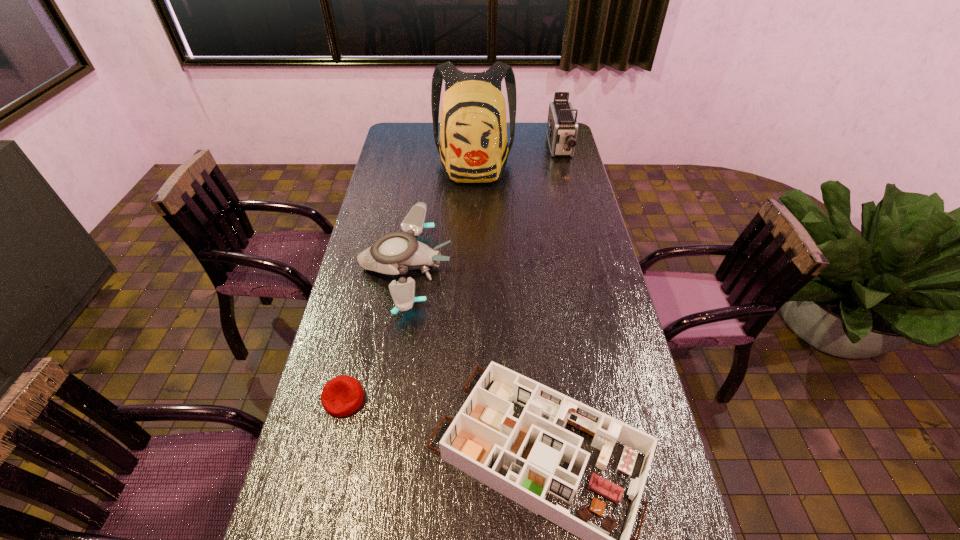
You are a GUI agent. You are given a task and a screenshot of the screen. Output one action in this format:
    pyautogui.click(x=<x>, y=<y>)
    Task: Click on the vacant space that is in between the backpack and the second tallest object
    
    Given the screenshot: What is the action you would take?
    pyautogui.click(x=516, y=157)

Select which object appears as the closest to the beanbag. Please provide its 2D coordinates. Your answer should be formatted as a tuple, i.e. [(x, y)], where the tuple contains the x and y coordinates of a point satisfying the conditions above.

[(519, 458)]

Identify which object is the nearest to the drone. Please provide its 2D coordinates. Your answer should be formatted as a tuple, i.e. [(x, y)], where the tuple contains the x and y coordinates of a point satisfying the conditions above.

[(519, 458)]

The width and height of the screenshot is (960, 540). Find the location of `vacant area that satisfies the following two spatial constraints: 1. on the front-facing side of the backpack; 2. on the front-facing side of the drone`. vacant area that satisfies the following two spatial constraints: 1. on the front-facing side of the backpack; 2. on the front-facing side of the drone is located at coordinates (472, 267).

In order to click on free space that satisfies the following two spatial constraints: 1. at the lens of the camcorder; 2. on the front-facing side of the third nearest object in this screenshot , I will do `click(588, 267)`.

Locate an element on the screen. This screenshot has width=960, height=540. free location that satisfies the following two spatial constraints: 1. on the front-facing side of the drone; 2. on the seat area of the shortest object is located at coordinates (384, 399).

At what (x,y) coordinates should I click in order to perform the action: click on free point that satisfies the following two spatial constraints: 1. at the lens of the camcorder; 2. on the front-facing side of the third nearest object. Please return your answer as a coordinate pair (x, y). Image resolution: width=960 pixels, height=540 pixels. Looking at the image, I should click on (588, 267).

At what (x,y) coordinates should I click in order to perform the action: click on free space that satisfies the following two spatial constraints: 1. on the front-facing side of the backpack; 2. on the front-facing side of the third farthest object. Please return your answer as a coordinate pair (x, y). Looking at the image, I should click on (472, 267).